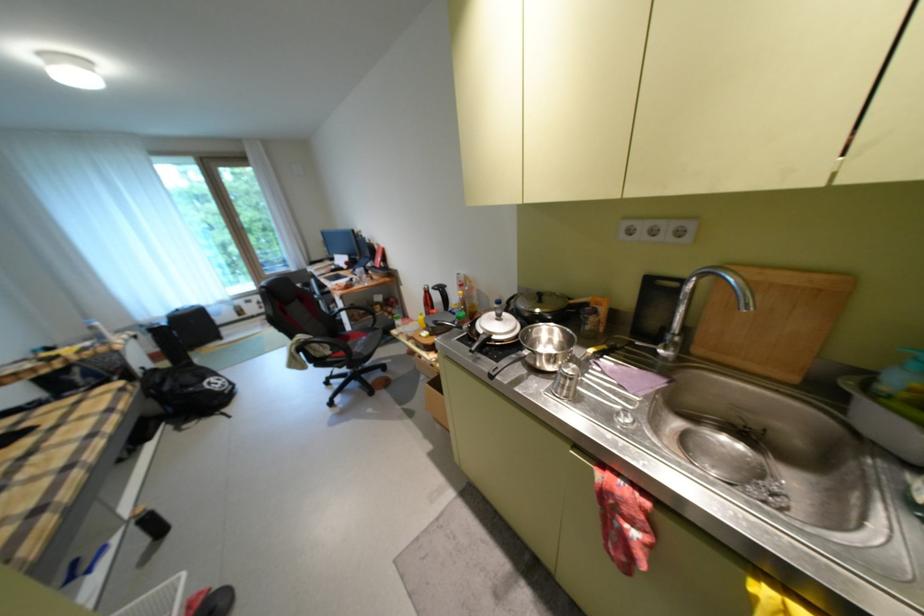
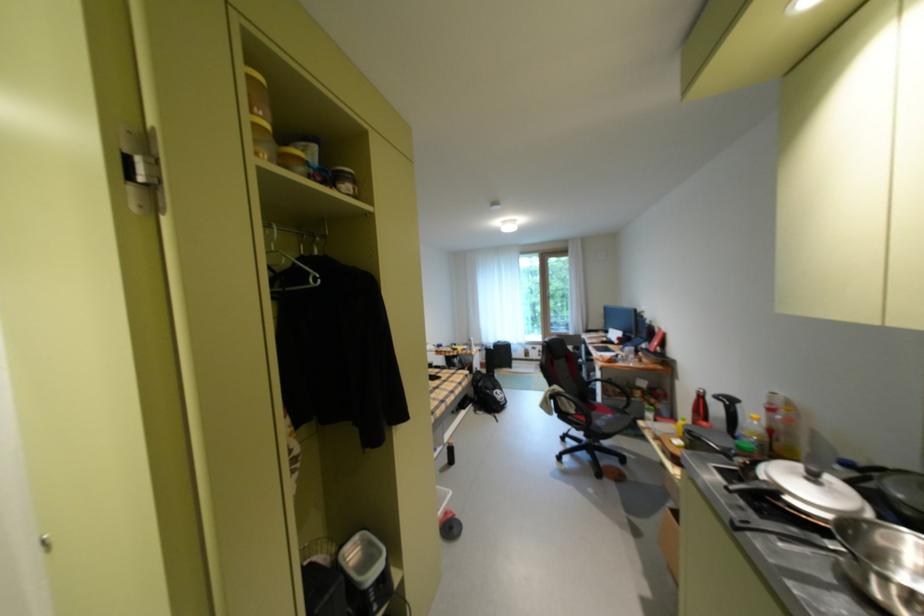
Locate, in the second image, the point that corresponds to (324,351) in the first image.

(573, 405)